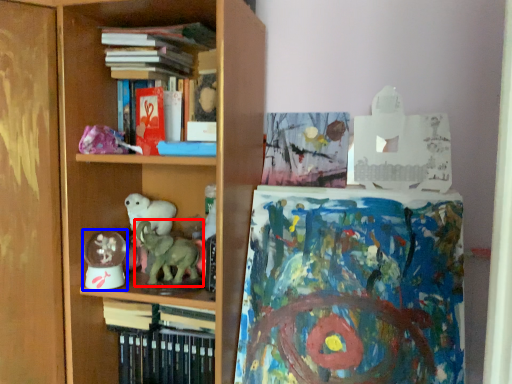
Question: Which object is closer to the camera taking this photo, animal (highlighted by a red box) or toy (highlighted by a blue box)?

Choices:
 (A) animal
 (B) toy

Answer: (A)